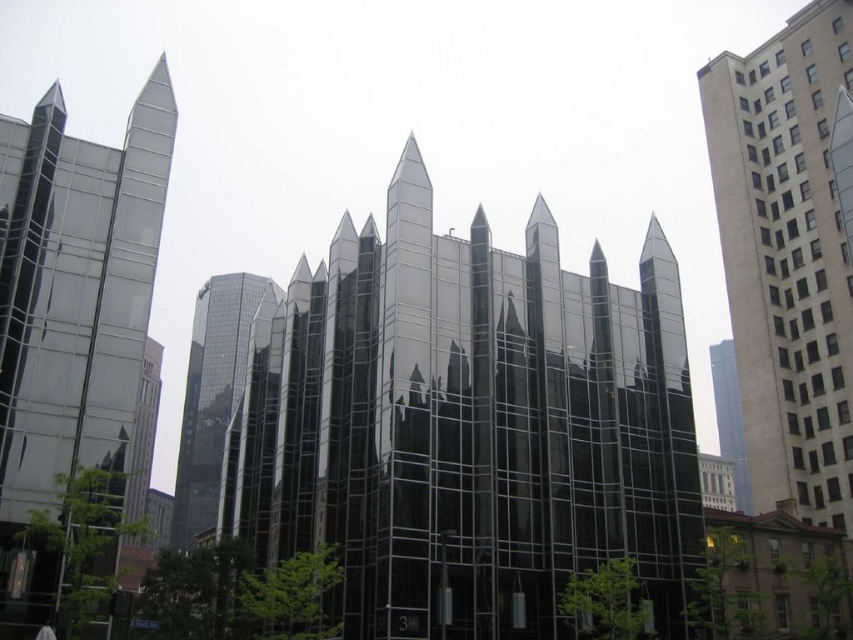
You are an architect analyzing the modern building in the image. The building has a central structure with spire protrusions. There is a specific point at coordinates point (468, 426). What object is located at this point?

The point (468, 426) is occupied by the shiny glass building at center.

You are an architect analyzing a modern building design. The coordinates point to a specific location on the building. Based on the scene description, what architectural feature is highlighted by the coordinates point at (468, 426)?

The coordinates point at (468, 426) highlight the shiny glass building at center, which features spire like protrusions made of reflective glass that mirror the surrounding buildings and sky.

Consider the image. You are an architect reviewing a cityscape design. You notice the shiny glass building at center and the polished glass skyscraper at left. Which one is positioned lower in the image?

The shiny glass building at center is positioned lower than the polished glass skyscraper at left in the image.